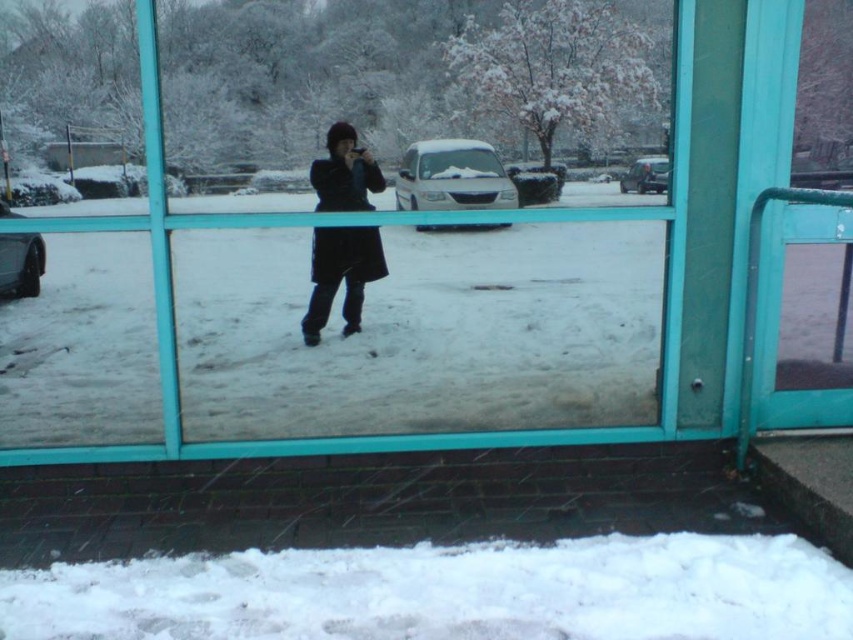
Which of these two, clear glass window at center or black matte coat at center, stands taller?

clear glass window at center is taller.

Who is higher up, clear glass window at center or black matte coat at center?

clear glass window at center

The height and width of the screenshot is (640, 853). Identify the location of clear glass window at center. (352, 257).

Does clear glass window at center have a larger size compared to white fluffy snow at lower center?

Yes.

You are a GUI agent. You are given a task and a screenshot of the screen. Output one action in this format:
    pyautogui.click(x=<x>, y=<y>)
    Task: Click on the clear glass window at center
    The image size is (853, 640).
    Given the screenshot: What is the action you would take?
    [352, 257]

Where is `clear glass window at center`? The image size is (853, 640). clear glass window at center is located at coordinates (352, 257).

Describe the element at coordinates (448, 593) in the screenshot. I see `white fluffy snow at lower center` at that location.

Can you confirm if white fluffy snow at lower center is shorter than black matte coat at center?

Yes.

At what (x,y) coordinates should I click in order to perform the action: click on white fluffy snow at lower center. Please return your answer as a coordinate pair (x, y). The height and width of the screenshot is (640, 853). Looking at the image, I should click on (448, 593).

You are a GUI agent. You are given a task and a screenshot of the screen. Output one action in this format:
    pyautogui.click(x=<x>, y=<y>)
    Task: Click on the white fluffy snow at lower center
    Image resolution: width=853 pixels, height=640 pixels.
    Given the screenshot: What is the action you would take?
    pyautogui.click(x=448, y=593)